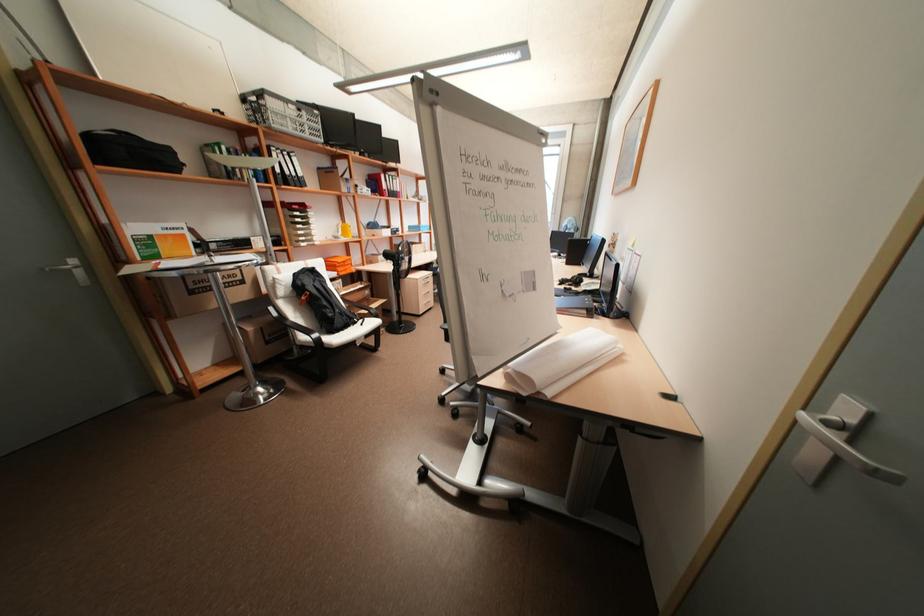
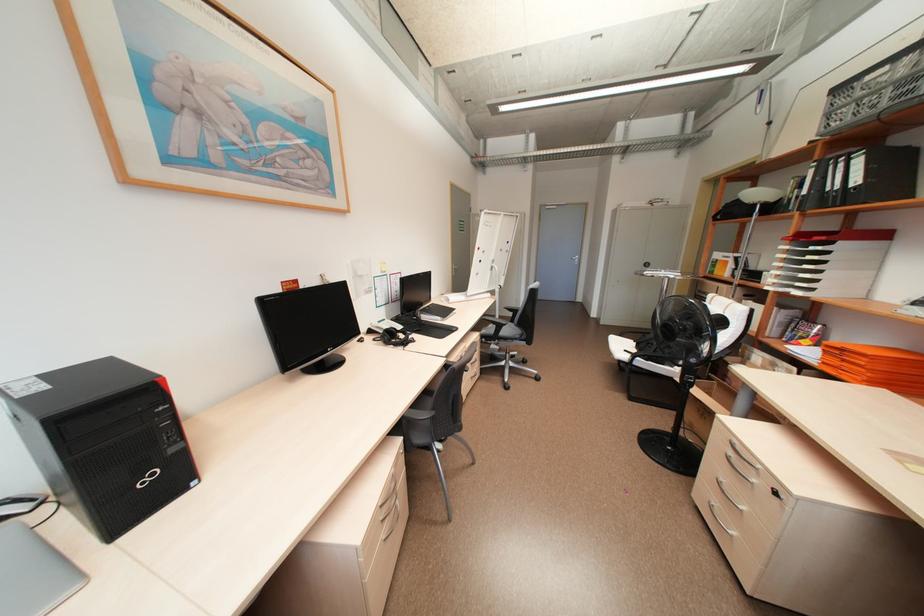
Locate, in the second image, the point that corresponds to point 284,169 in the first image.

(810, 191)